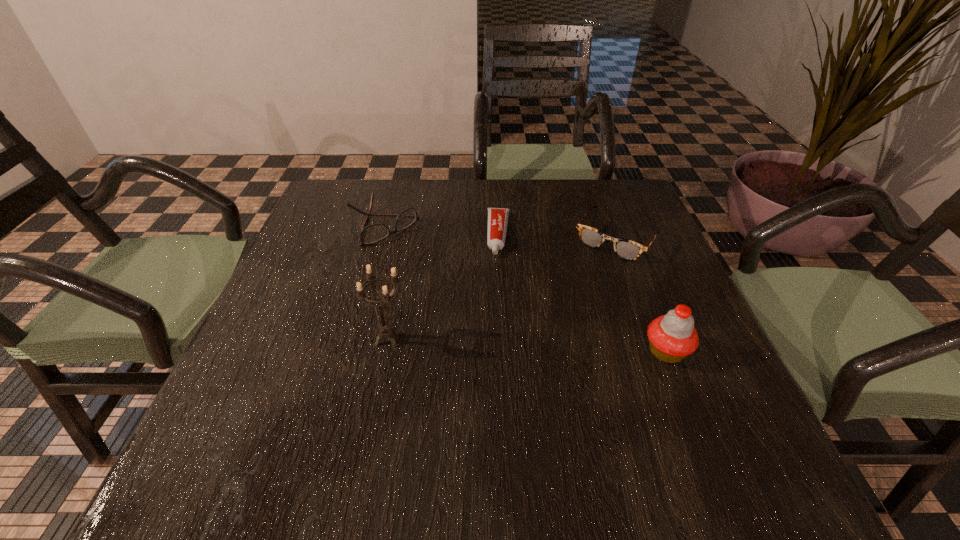
The width and height of the screenshot is (960, 540). I want to click on vacant spot on the desktop that is between the candle holder and the cupcake and is positioned on the front-facing side of the left spectacles, so click(528, 345).

Locate an element on the screen. free space on the desktop that is between the tallest object and the cupcake and is positioned on the frame of the right spectacles is located at coordinates (542, 346).

Find the location of a particular element. vacant space on the desktop that is between the tallest object and the cupcake and is positioned at the nozzle of the shortest object is located at coordinates (492, 343).